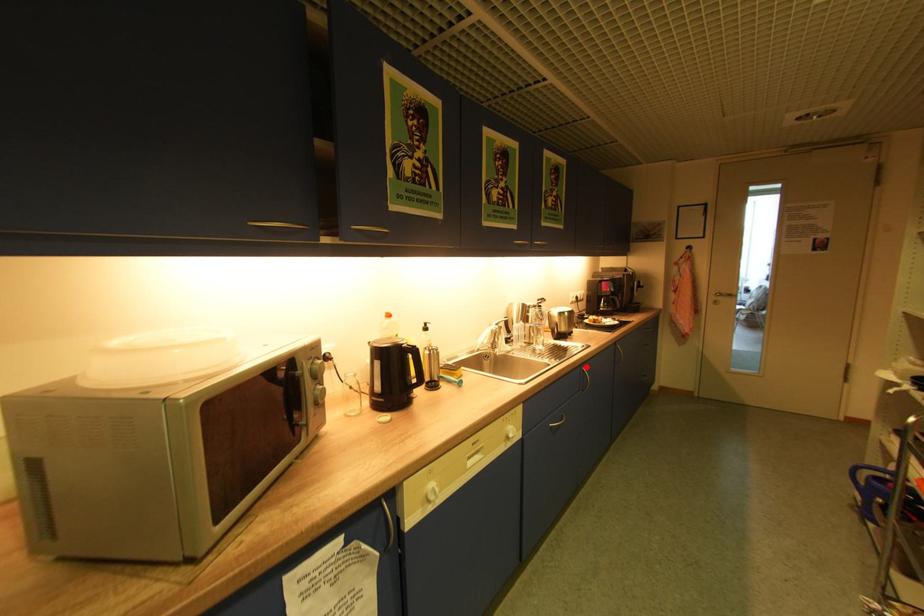
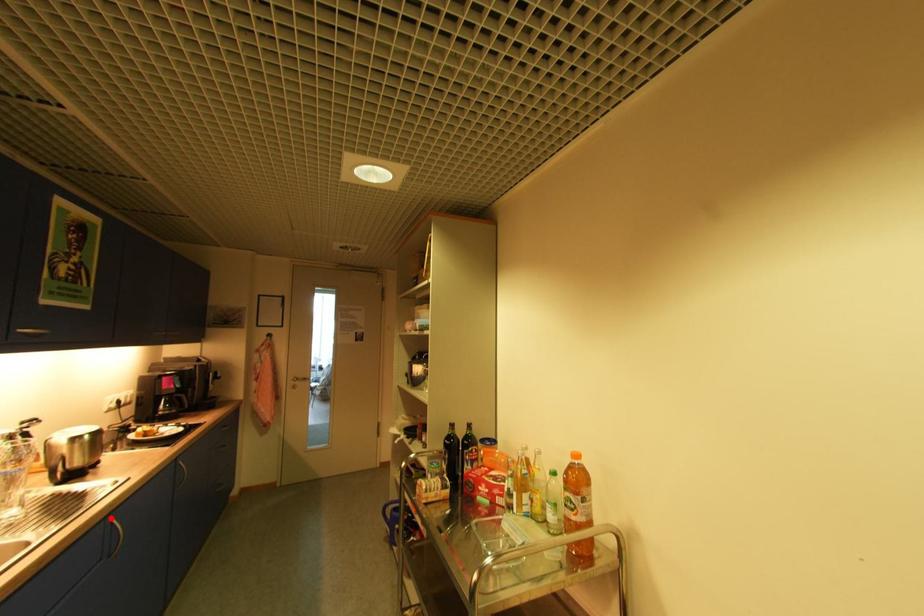
I am providing you with two images of the same scene from different viewpoints. A red point is marked on the first image and another point is marked on the second image. Does the point marked in image1 correspond to the same location as the one in image2?

Yes